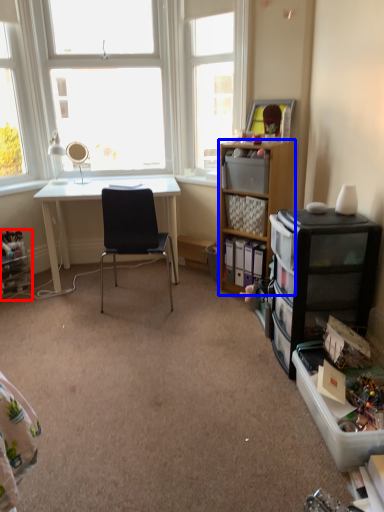
Question: Among these objects, which one is nearest to the camera, shelf (highlighted by a red box) or cabinetry (highlighted by a blue box)?

Choices:
 (A) shelf
 (B) cabinetry

Answer: (B)